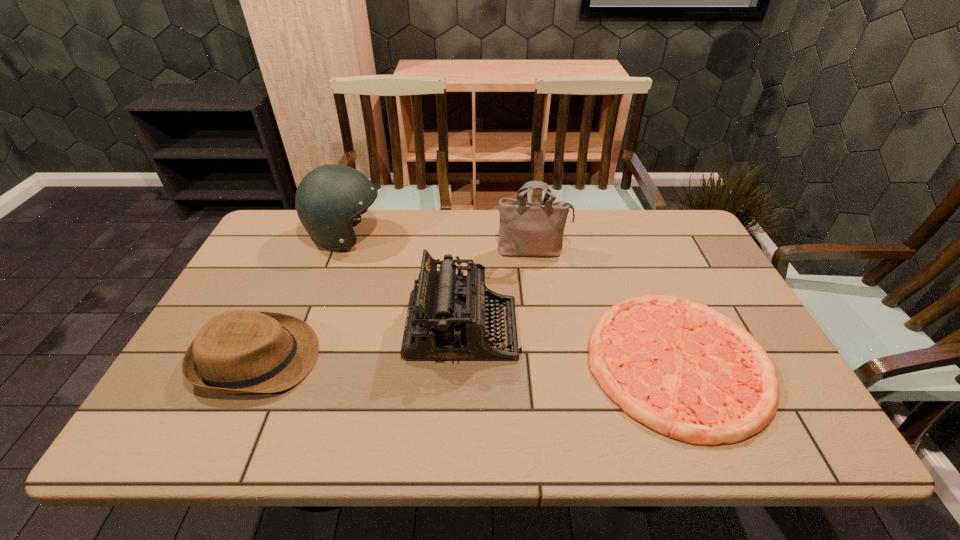
Identify the location of shoulder bag that is at the far edge. The height and width of the screenshot is (540, 960). (526, 228).

You are a GUI agent. You are given a task and a screenshot of the screen. Output one action in this format:
    pyautogui.click(x=<x>, y=<y>)
    Task: Click on the football helmet located at the far edge
    The image size is (960, 540).
    Given the screenshot: What is the action you would take?
    pyautogui.click(x=329, y=197)

Where is `object that is positioned at the near edge`? object that is positioned at the near edge is located at coordinates (685, 370).

Identify the location of football helmet at the left edge. The image size is (960, 540). (329, 197).

Locate an element on the screen. fedora located at the left edge is located at coordinates (240, 351).

Where is `object present at the right edge`? This screenshot has width=960, height=540. object present at the right edge is located at coordinates coord(685,370).

The width and height of the screenshot is (960, 540). I want to click on object positioned at the far left corner, so click(329, 197).

You are a GUI agent. You are given a task and a screenshot of the screen. Output one action in this format:
    pyautogui.click(x=<x>, y=<y>)
    Task: Click on the object that is at the near right corner
    The image size is (960, 540).
    Given the screenshot: What is the action you would take?
    pyautogui.click(x=685, y=370)

Locate an element on the screen. This screenshot has height=540, width=960. free region at the near edge is located at coordinates (663, 439).

This screenshot has height=540, width=960. In the image, there is a desktop. Identify the location of vacant space at the left edge. (257, 303).